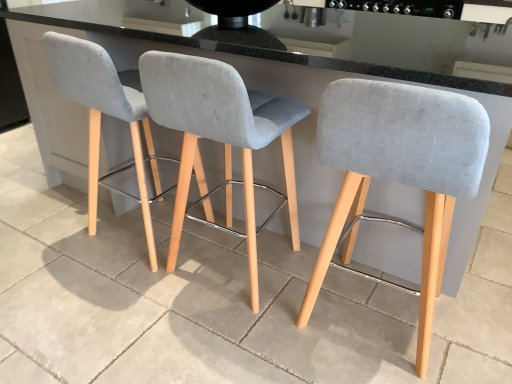
Question: Looking at their shapes, would you say black glossy stove at upper center is wider or thinner than light gray fabric stool at left, which appears as the first chair when viewed from the left?

Choices:
 (A) wide
 (B) thin

Answer: (A)

Question: In the image, is black glossy stove at upper center on the left side or the right side of light gray fabric stool at left, which appears as the first chair when viewed from the left?

Choices:
 (A) right
 (B) left

Answer: (A)

Question: Which object is positioned farthest from the light gray fabric stool at left, which appears as the first chair when viewed from the left?

Choices:
 (A) light gray fabric stool at center, the 1th chair in the right-to-left sequence
 (B) black glossy stove at upper center
 (C) light gray fabric stool at center, placed as the second chair when sorted from left to right
 (D) gray concrete at center

Answer: (B)

Question: Which of these objects is positioned closest to the gray concrete at center?

Choices:
 (A) light gray fabric stool at center, the 2th chair positioned from the right
 (B) light gray fabric stool at left, the third chair when ordered from right to left
 (C) black glossy stove at upper center
 (D) light gray fabric stool at center, the 1th chair in the right-to-left sequence

Answer: (B)